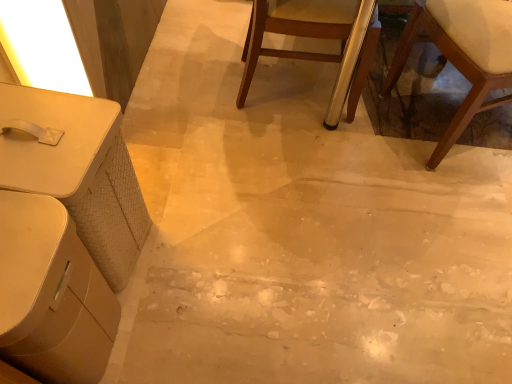
Question: Is white matte table at left, the second table positioned from the bottom, wider than white glossy table at lower left, the second table positioned from the top?

Choices:
 (A) yes
 (B) no

Answer: (B)

Question: Is white matte table at left, which is counted as the 1th table, starting from the top, closer to camera compared to white glossy table at lower left, arranged as the first table when ordered from the bottom?

Choices:
 (A) yes
 (B) no

Answer: (B)

Question: Does white matte table at left, the second table positioned from the bottom, have a smaller size compared to white glossy table at lower left, arranged as the first table when ordered from the bottom?

Choices:
 (A) yes
 (B) no

Answer: (A)

Question: From a real-world perspective, is white matte table at left, the second table positioned from the bottom, positioned over white glossy table at lower left, the second table positioned from the top, based on gravity?

Choices:
 (A) no
 (B) yes

Answer: (A)

Question: Considering the relative sizes of white matte table at left, which is counted as the 1th table, starting from the top, and white glossy table at lower left, the second table positioned from the top, in the image provided, is white matte table at left, which is counted as the 1th table, starting from the top, taller than white glossy table at lower left, the second table positioned from the top,?

Choices:
 (A) yes
 (B) no

Answer: (B)

Question: Can you confirm if white matte table at left, the second table positioned from the bottom, is shorter than white glossy table at lower left, the second table positioned from the top?

Choices:
 (A) no
 (B) yes

Answer: (B)

Question: Is white glossy table at lower left, arranged as the first table when ordered from the bottom, positioned far away from wooden chair with white cushion at lower right, which is counted as the second chair, starting from the left?

Choices:
 (A) yes
 (B) no

Answer: (A)

Question: From the image's perspective, is white glossy table at lower left, the second table positioned from the top, beneath wooden chair with white cushion at lower right, which is counted as the second chair, starting from the left?

Choices:
 (A) no
 (B) yes

Answer: (B)

Question: Is wooden chair with white cushion at lower right, which is counted as the second chair, starting from the left, at the back of white glossy table at lower left, the second table positioned from the top?

Choices:
 (A) yes
 (B) no

Answer: (B)

Question: From a real-world perspective, is white glossy table at lower left, the second table positioned from the top, physically below wooden chair with white cushion at lower right, positioned as the first chair in right-to-left order?

Choices:
 (A) no
 (B) yes

Answer: (B)

Question: From the image's perspective, is white glossy table at lower left, the second table positioned from the top, located above wooden chair with white cushion at lower right, which is counted as the second chair, starting from the left?

Choices:
 (A) yes
 (B) no

Answer: (B)

Question: Considering the relative positions of white glossy table at lower left, the second table positioned from the top, and wooden chair with white cushion at lower right, positioned as the first chair in right-to-left order, in the image provided, is white glossy table at lower left, the second table positioned from the top, to the right of wooden chair with white cushion at lower right, positioned as the first chair in right-to-left order, from the viewer's perspective?

Choices:
 (A) no
 (B) yes

Answer: (A)

Question: From a real-world perspective, is wooden chair at center, the 2th chair when ordered from right to left, beneath wooden chair with white cushion at lower right, positioned as the first chair in right-to-left order?

Choices:
 (A) no
 (B) yes

Answer: (B)